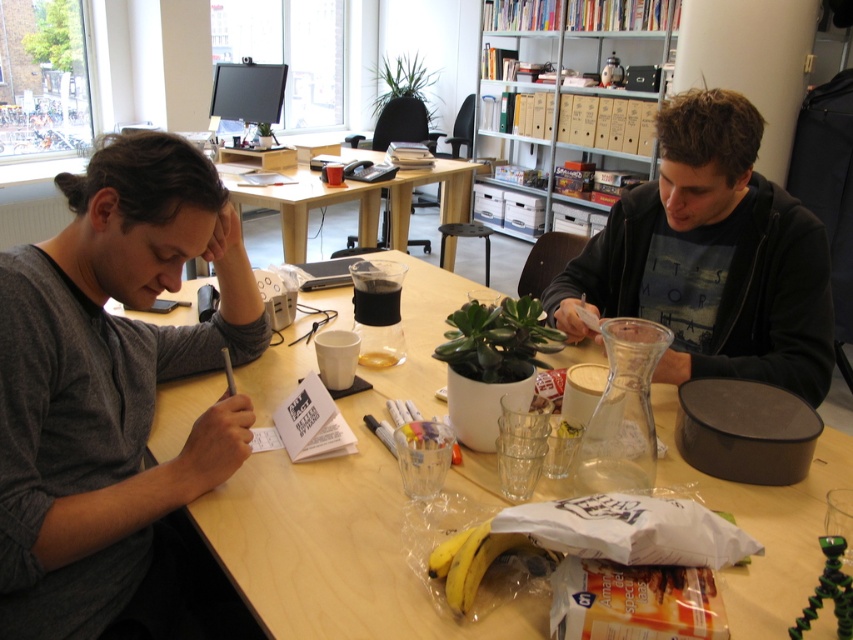
You are standing at the entrance of the room and want to place a 2.5 meters long ladder between the gray cotton shirt at left and the light wood table at center. Is there enough space for the ladder?

The gray cotton shirt at left is 2.06 meters away from the light wood table at center, so the 2.5 meters long ladder would not fit between them as the distance is shorter than the ladder.

You are standing in the office scene described. You need to locate the gray cotton shirt at left. Where exactly should you look in terms of coordinates?

The gray cotton shirt at left is located at coordinates point (x=119, y=403).

You are a delivery person entering the office and need to place a package on the gray cotton shirt at left without disturbing the light wood table at center. Is this possible?

The gray cotton shirt at left is positioned under the light wood table at center, so placing a package on the shirt would require placing it under the table, which might not be possible without moving the table or the shirt.